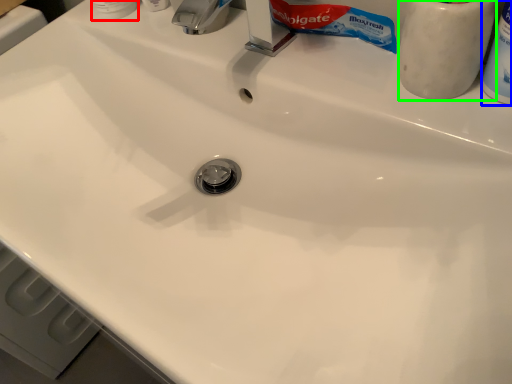
Question: Considering the real-world distances, which object is closest to toiletry (highlighted by a red box)? toiletry (highlighted by a blue box) or toiletry (highlighted by a green box).

Choices:
 (A) toiletry
 (B) toiletry

Answer: (B)